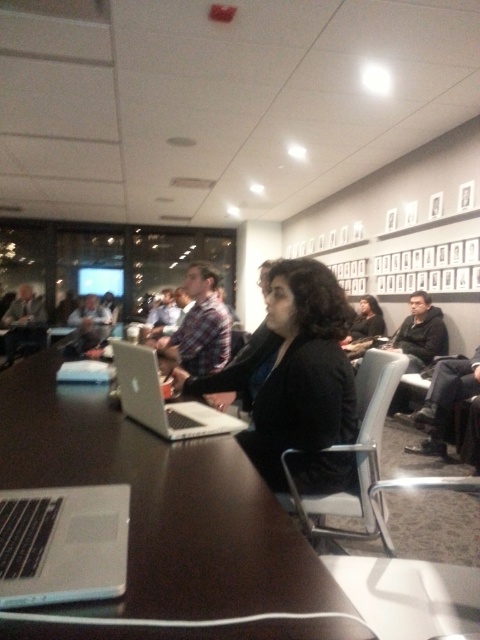
Question: Is dark wood table at center below silver metallic laptop at lower left?

Choices:
 (A) yes
 (B) no

Answer: (B)

Question: Which of the following is the closest to the observer?

Choices:
 (A) silver metallic laptop at center
 (B) black matte jacket at center
 (C) dark wood table at center
 (D) white plastic chair at center

Answer: (C)

Question: Can you confirm if dark wood table at center is bigger than silver metallic laptop at lower left?

Choices:
 (A) no
 (B) yes

Answer: (B)

Question: Estimate the real-world distances between objects in this image. Which object is farther from the white plastic chair at center?

Choices:
 (A) silver metallic laptop at center
 (B) dark wood table at center

Answer: (B)

Question: Can you confirm if black matte jacket at center is wider than silver metallic laptop at lower left?

Choices:
 (A) yes
 (B) no

Answer: (A)

Question: Which is farther from the silver metallic laptop at lower left?

Choices:
 (A) silver metallic laptop at center
 (B) dark wood table at center
 (C) white plastic chair at center

Answer: (C)